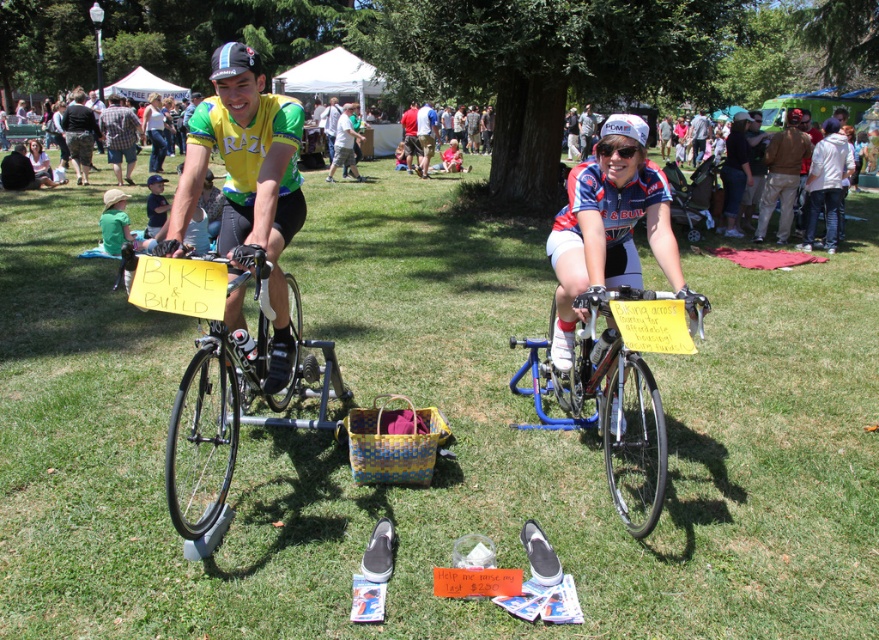
You are standing at the edge of the field and see the blue metallic bicycle at center and the plaid shirt at center. If you want to reach both items quickly, which one should you head towards first?

The blue metallic bicycle at center is 15.86 meters away from the plaid shirt at center, so you should head towards whichever is closer to your current position. However, since both are at the same central location, you can reach them simultaneously.

You are a photographer at the event and want to capture both the blue metallic bicycle at center and the light blue jersey at center in a single photo. Which object should you focus on first to ensure both are in frame?

The blue metallic bicycle at center is shorter than the light blue jersey at center, so you should focus on the blue metallic bicycle at center first to ensure both are in frame.

You are standing at the blue metallic bicycle at center and want to reach the nearest person. Which direction should you go?

The blue metallic bicycle at center is 11.10 feet away from the nearest person, so you should go towards the person on the right since they are closer.